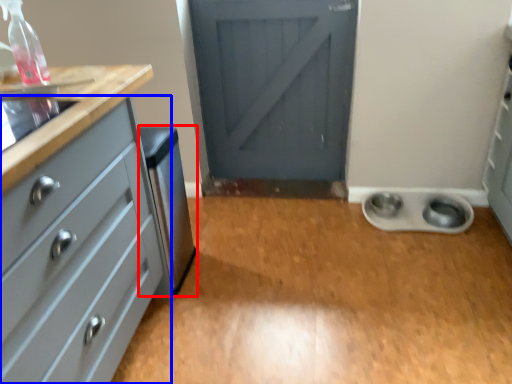
Question: Which point is further to the camera, appliance (highlighted by a red box) or chest of drawers (highlighted by a blue box)?

Choices:
 (A) appliance
 (B) chest of drawers

Answer: (A)